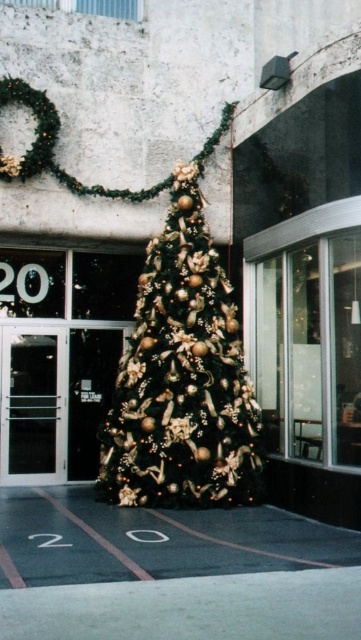
You are moving a 6.5 feet wide sofa through the transparent glass door at left. The shiny gold christmas tree at center is in your way. Can you move the sofa through the door without hitting the tree?

The distance between the shiny gold christmas tree at center and the transparent glass door at left is 6.93 feet. Since the sofa is 6.5 feet wide, there is enough space to move it through the transparent glass door at left without hitting the tree.

You are standing in front of the building and want to enter through the transparent glass door at left. However, there is a shiny gold christmas tree at center blocking your path. Can you walk around the tree to reach the door?

The shiny gold christmas tree at center is in front of the transparent glass door at left, so you can walk around the tree to reach the door since it is blocking the direct path but not the sides.